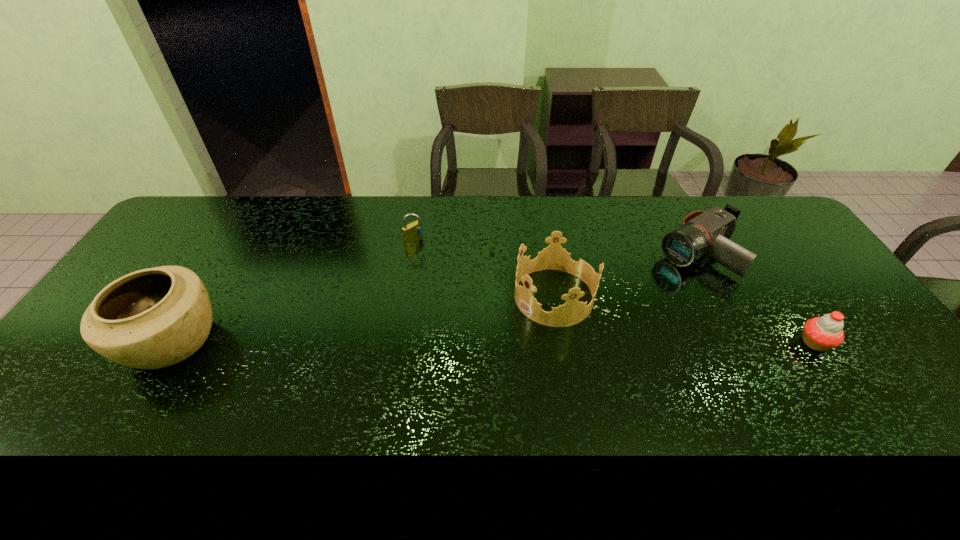
The image size is (960, 540). Find the location of `pottery`. pottery is located at coordinates (153, 318).

Where is `the tallest object`? The image size is (960, 540). the tallest object is located at coordinates (153, 318).

Locate an element on the screen. The height and width of the screenshot is (540, 960). cupcake is located at coordinates (822, 333).

This screenshot has height=540, width=960. Identify the location of the fourth shortest object. (554, 257).

Image resolution: width=960 pixels, height=540 pixels. Identify the location of the third object from left to right. coord(554,257).

Image resolution: width=960 pixels, height=540 pixels. In order to click on camcorder in this screenshot , I will do `click(701, 232)`.

This screenshot has height=540, width=960. What are the coordinates of `the fourth object from right to left` in the screenshot? It's located at (413, 231).

Locate an element on the screen. The height and width of the screenshot is (540, 960). free space located on the back of the leftmost object is located at coordinates (243, 224).

Where is `free location located on the back of the cupcake`? free location located on the back of the cupcake is located at coordinates pos(754,250).

You are a GUI agent. You are given a task and a screenshot of the screen. Output one action in this format:
    pyautogui.click(x=<x>, y=<y>)
    Task: Click on the vacant space situated on the front-facing side of the tiara
    The width and height of the screenshot is (960, 540).
    Given the screenshot: What is the action you would take?
    pyautogui.click(x=416, y=383)